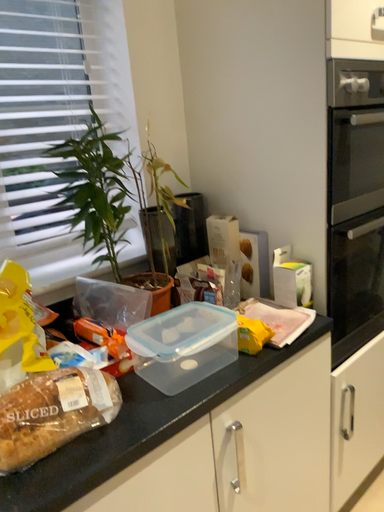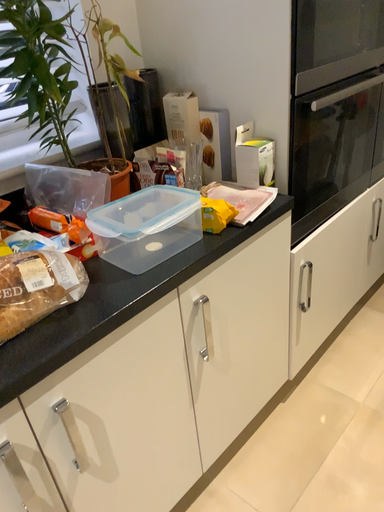
Question: How did the camera likely rotate when shooting the video?

Choices:
 (A) rotated downward
 (B) rotated upward

Answer: (A)